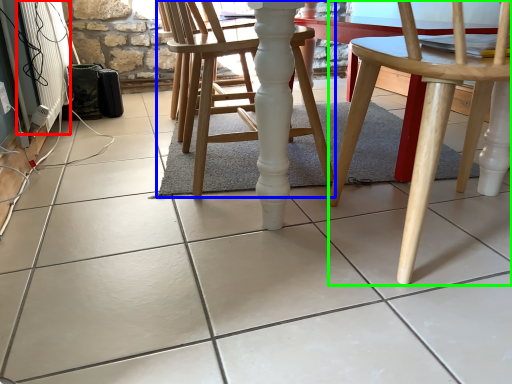
Question: Which object is the closest to the radiator (highlighted by a red box)? Choose among these: chair (highlighted by a blue box) or chair (highlighted by a green box).

Choices:
 (A) chair
 (B) chair

Answer: (A)